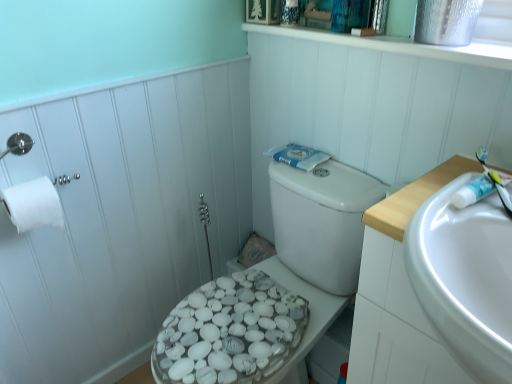
Question: From a real-world perspective, is white glossy sink at right above or below white pebble-patterned toilet seat at left?

Choices:
 (A) below
 (B) above

Answer: (A)

Question: Is white glossy sink at right bigger or smaller than white pebble-patterned toilet seat at left?

Choices:
 (A) big
 (B) small

Answer: (A)

Question: Based on their relative distances, which object is farther from the white glossy sink at right?

Choices:
 (A) white pebble-patterned toilet seat at left
 (B) white glossy porcelain at center
 (C) white plastic toothbrush at right
 (D) white matte toilet paper at left

Answer: (A)

Question: Which is farther from the white plastic toothbrush at right?

Choices:
 (A) white glossy porcelain at center
 (B) white glossy sink at right
 (C) white pebble-patterned toilet seat at left
 (D) white matte toilet paper at left

Answer: (C)